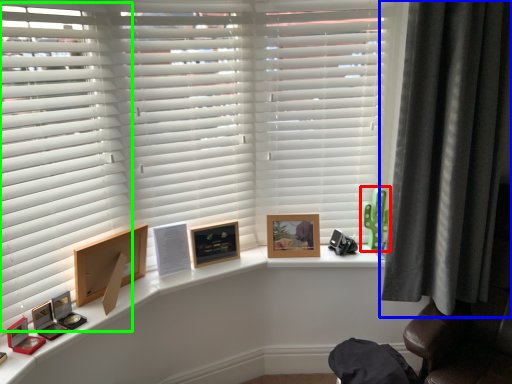
Question: Considering the real-world distances, which object is farthest from toy (highlighted by a red box)? curtain (highlighted by a blue box) or shutter (highlighted by a green box)?

Choices:
 (A) curtain
 (B) shutter

Answer: (B)